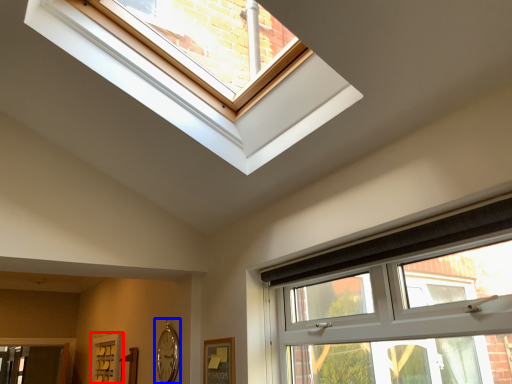
Question: Which of the following is the farthest to the observer, screen door (highlighted by a red box) or clock (highlighted by a blue box)?

Choices:
 (A) screen door
 (B) clock

Answer: (A)